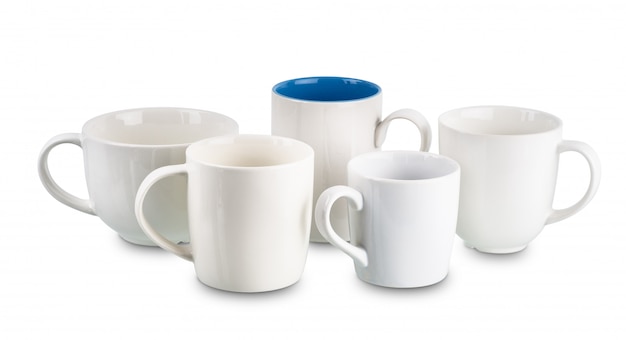
At what (x,y) coordinates should I click in order to perform the action: click on mug handle. Please return your answer as a coordinate pair (x, y). Looking at the image, I should click on (597, 164), (421, 122), (331, 196), (139, 194), (42, 162).